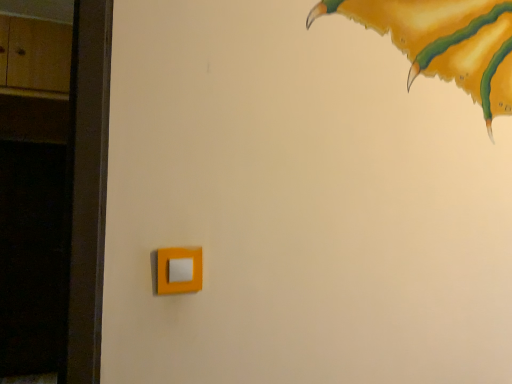
Question: Should I look upward or downward to see matte white switch at lower center?

Choices:
 (A) up
 (B) down

Answer: (B)